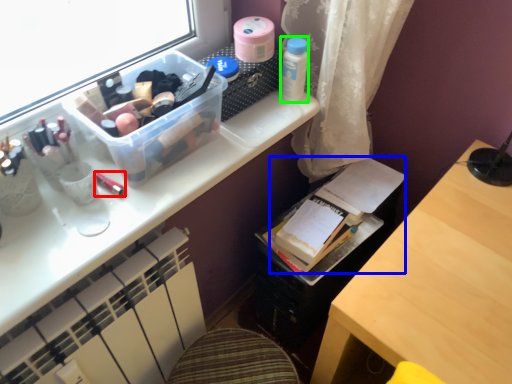
Question: Estimate the real-world distances between objects in this image. Which object is farther from toiletry (highlighted by a red box), book (highlighted by a blue box) or toiletry (highlighted by a green box)?

Choices:
 (A) book
 (B) toiletry

Answer: (A)